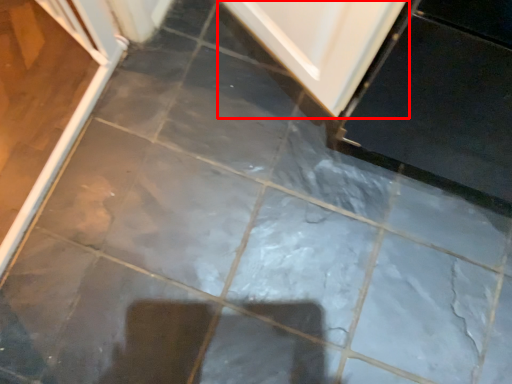
Question: Observing the image, what is the correct spatial positioning of door (annotated by the red box) in reference to screen door?

Choices:
 (A) left
 (B) right

Answer: (B)